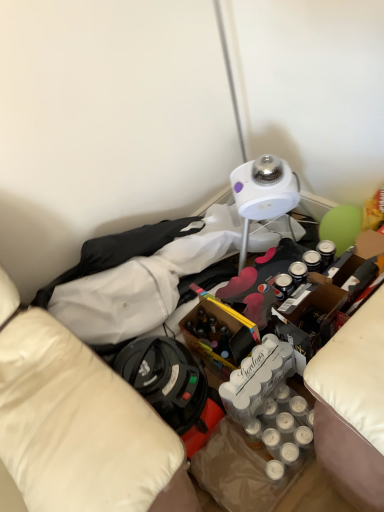
What do you see at coordinates (219, 331) in the screenshot? I see `translucent glass wine bottle at center` at bounding box center [219, 331].

The width and height of the screenshot is (384, 512). Identify the location of translucent glass wine bottle at center. (219, 331).

The width and height of the screenshot is (384, 512). Describe the element at coordinates (119, 251) in the screenshot. I see `white smooth shirt at upper left` at that location.

Identify the location of white smooth shirt at upper left. The width and height of the screenshot is (384, 512). (119, 251).

Where is `translucent glass wine bottle at center`? The height and width of the screenshot is (512, 384). translucent glass wine bottle at center is located at coordinates (219, 331).

Which object is positioned more to the right, translucent glass wine bottle at center or white smooth shirt at upper left?

Positioned to the right is translucent glass wine bottle at center.

Which object is further away from the camera, translucent glass wine bottle at center or white smooth shirt at upper left?

white smooth shirt at upper left is further from the camera.

Which is behind, point (207, 329) or point (120, 264)?

Positioned behind is point (120, 264).

From the image's perspective, is translucent glass wine bottle at center above white smooth shirt at upper left?

No.

From a real-world perspective, who is located higher, translucent glass wine bottle at center or white smooth shirt at upper left?

white smooth shirt at upper left is physically above.

Is translucent glass wine bottle at center thinner than white smooth shirt at upper left?

No.

Does translucent glass wine bottle at center have a greater height compared to white smooth shirt at upper left?

Indeed, translucent glass wine bottle at center has a greater height compared to white smooth shirt at upper left.

Between translucent glass wine bottle at center and white smooth shirt at upper left, which one has larger size?

Bigger between the two is white smooth shirt at upper left.

Can we say translucent glass wine bottle at center lies outside white smooth shirt at upper left?

Yes, translucent glass wine bottle at center is outside of white smooth shirt at upper left.

Are translucent glass wine bottle at center and white smooth shirt at upper left far apart?

No, there isn't a large distance between translucent glass wine bottle at center and white smooth shirt at upper left.

Is translucent glass wine bottle at center oriented away from white smooth shirt at upper left?

Correct, translucent glass wine bottle at center is looking away from white smooth shirt at upper left.

Identify the location of wine bottle that appears on the right of white smooth shirt at upper left. (219, 331).

Based on the photo, considering the relative positions of white smooth shirt at upper left and translucent glass wine bottle at center in the image provided, is white smooth shirt at upper left to the right of translucent glass wine bottle at center from the viewer's perspective?

No.

Does white smooth shirt at upper left come in front of translucent glass wine bottle at center?

No, the depth of white smooth shirt at upper left is greater than that of translucent glass wine bottle at center.

Considering the points (93, 244) and (209, 312), which point is behind, point (93, 244) or point (209, 312)?

The point (209, 312) is farther.

From the image's perspective, does white smooth shirt at upper left appear lower than translucent glass wine bottle at center?

Incorrect, from the image's perspective, white smooth shirt at upper left is higher than translucent glass wine bottle at center.

Looking at this image, from a real-world perspective, is white smooth shirt at upper left on top of translucent glass wine bottle at center?

Yes.

Considering the sizes of white smooth shirt at upper left and translucent glass wine bottle at center in the image, is white smooth shirt at upper left wider or thinner than translucent glass wine bottle at center?

Clearly, white smooth shirt at upper left has less width compared to translucent glass wine bottle at center.

Does white smooth shirt at upper left have a lesser height compared to translucent glass wine bottle at center?

Yes, white smooth shirt at upper left is shorter than translucent glass wine bottle at center.

Considering the sizes of objects white smooth shirt at upper left and translucent glass wine bottle at center in the image provided, who is smaller, white smooth shirt at upper left or translucent glass wine bottle at center?

translucent glass wine bottle at center.

In the scene shown: Is white smooth shirt at upper left not within translucent glass wine bottle at center?

That's correct, white smooth shirt at upper left is outside of translucent glass wine bottle at center.

From the picture: Does white smooth shirt at upper left touch translucent glass wine bottle at center?

No, white smooth shirt at upper left is not touching translucent glass wine bottle at center.

Is white smooth shirt at upper left turned away from translucent glass wine bottle at center?

No, white smooth shirt at upper left is not facing away from translucent glass wine bottle at center.

How many degrees apart are the facing directions of white smooth shirt at upper left and translucent glass wine bottle at center?

They differ by 4.46 degrees in their facing directions.

This screenshot has width=384, height=512. What are the coordinates of `wine bottle below the white smooth shirt at upper left (from a real-world perspective)` in the screenshot? It's located at (219, 331).

Find the location of `clothing that appears above the translucent glass wine bottle at center (from the image's perspective)`. clothing that appears above the translucent glass wine bottle at center (from the image's perspective) is located at coordinates pos(119,251).

You are a GUI agent. You are given a task and a screenshot of the screen. Output one action in this format:
    pyautogui.click(x=<x>, y=<y>)
    Task: Click on the wine bottle on the right of white smooth shirt at upper left
    Image resolution: width=384 pixels, height=512 pixels.
    Given the screenshot: What is the action you would take?
    pyautogui.click(x=219, y=331)